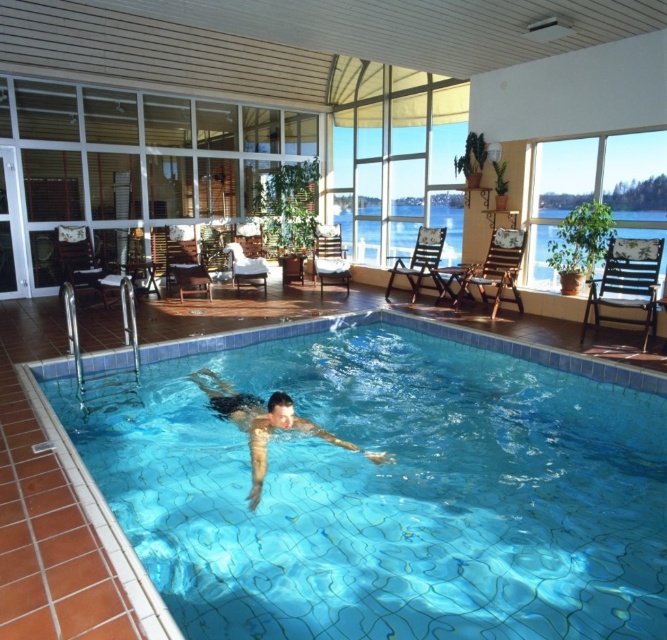
Question: Is blue tile swimming pool at center positioned at the back of skinny man at center?

Choices:
 (A) no
 (B) yes

Answer: (A)

Question: Among these objects, which one is nearest to the camera?

Choices:
 (A) blue tile swimming pool at center
 (B) skinny man at center

Answer: (A)

Question: Is blue tile swimming pool at center positioned at the back of skinny man at center?

Choices:
 (A) yes
 (B) no

Answer: (B)

Question: Can you confirm if blue tile swimming pool at center is positioned to the left of skinny man at center?

Choices:
 (A) no
 (B) yes

Answer: (A)

Question: Which point is farther to the camera?

Choices:
 (A) blue tile swimming pool at center
 (B) skinny man at center

Answer: (B)